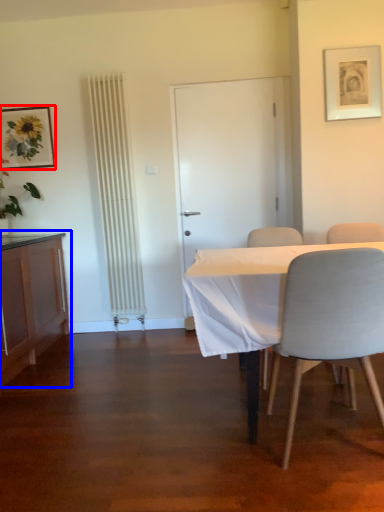
Question: Which object is further to the camera taking this photo, picture frame (highlighted by a red box) or cabinetry (highlighted by a blue box)?

Choices:
 (A) picture frame
 (B) cabinetry

Answer: (A)